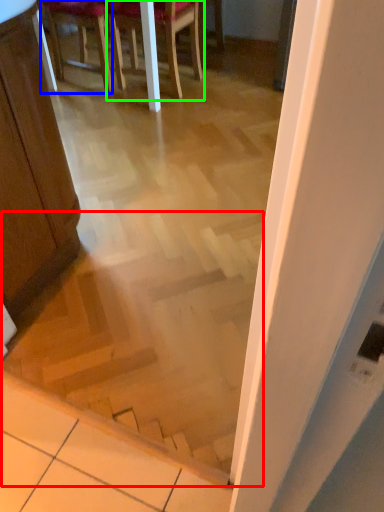
Question: Estimate the real-world distances between objects in this image. Which object is farther from stairwell (highlighted by a red box), chair (highlighted by a blue box) or chair (highlighted by a green box)?

Choices:
 (A) chair
 (B) chair

Answer: (A)